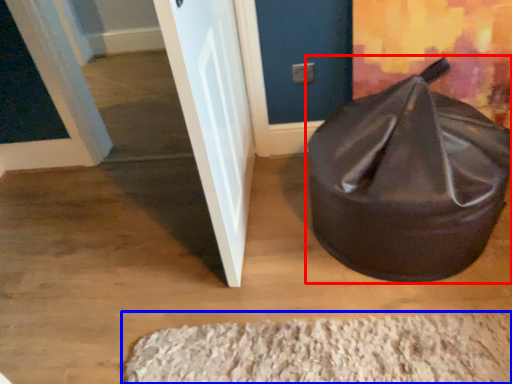
Question: Which point is further to the camera, bean bag chair (highlighted by a red box) or doormat (highlighted by a blue box)?

Choices:
 (A) bean bag chair
 (B) doormat

Answer: (B)